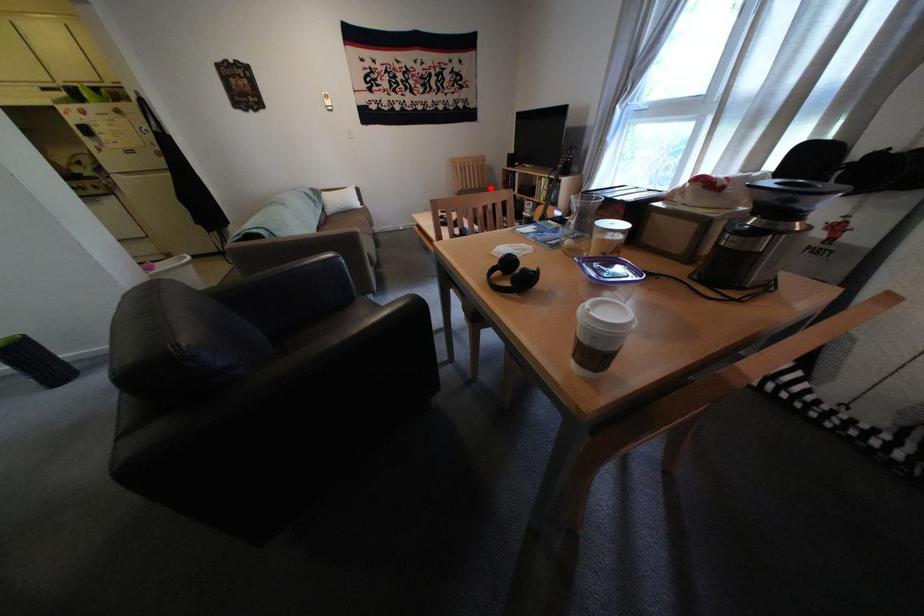
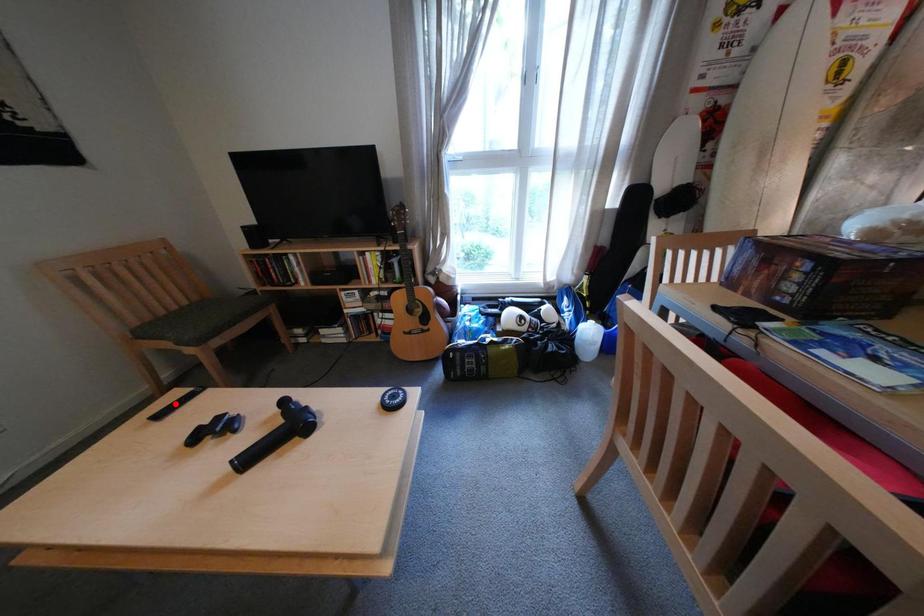
I am providing you with two images of the same scene from different viewpoints. A red point is marked on the first image and another point is marked on the second image. Is the marked point in image1 the same physical position as the marked point in image2?

No